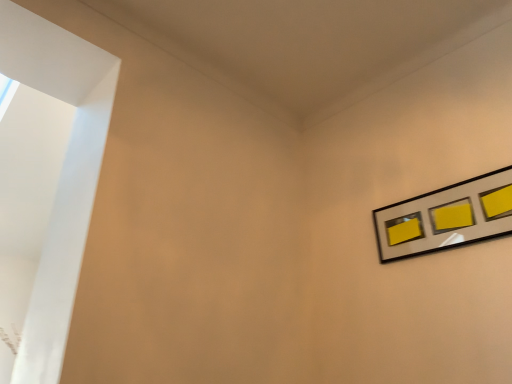
Image resolution: width=512 pixels, height=384 pixels. What do you see at coordinates (446, 217) in the screenshot?
I see `metallic silver picture frame at upper right` at bounding box center [446, 217].

The image size is (512, 384). What are the coordinates of `metallic silver picture frame at upper right` in the screenshot? It's located at (446, 217).

Measure the distance between point (450, 212) and camera.

The distance of point (450, 212) from camera is 4.92 feet.

Where is `metallic silver picture frame at upper right`? The image size is (512, 384). metallic silver picture frame at upper right is located at coordinates (446, 217).